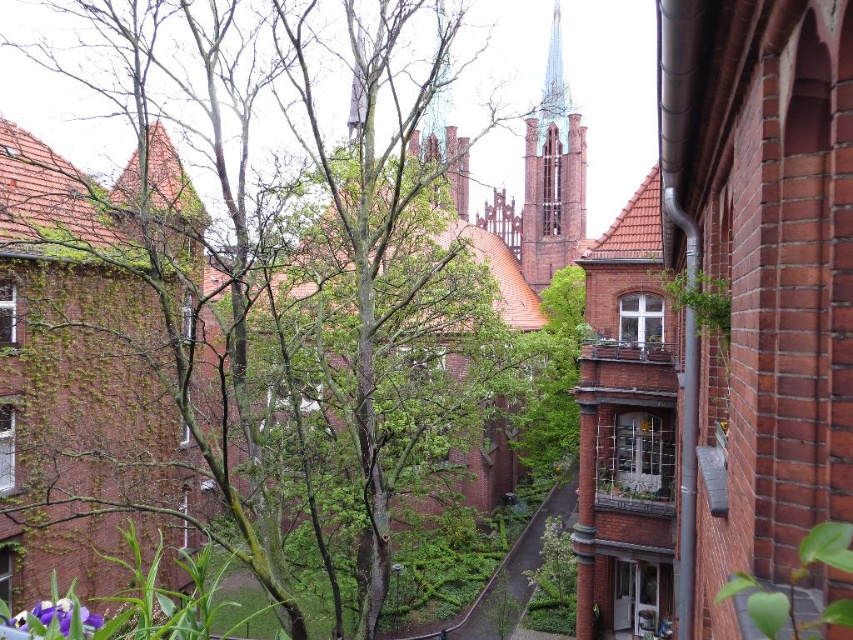
You are standing on the balcony and want to take a photo of both the green leafy tree at center and the purple matte flower at lower left. Which object should you frame first in your camera to ensure both are in the shot?

You should frame the purple matte flower at lower left first because the green leafy tree at center is positioned to its right, so starting with the flower ensures both are included in the frame.